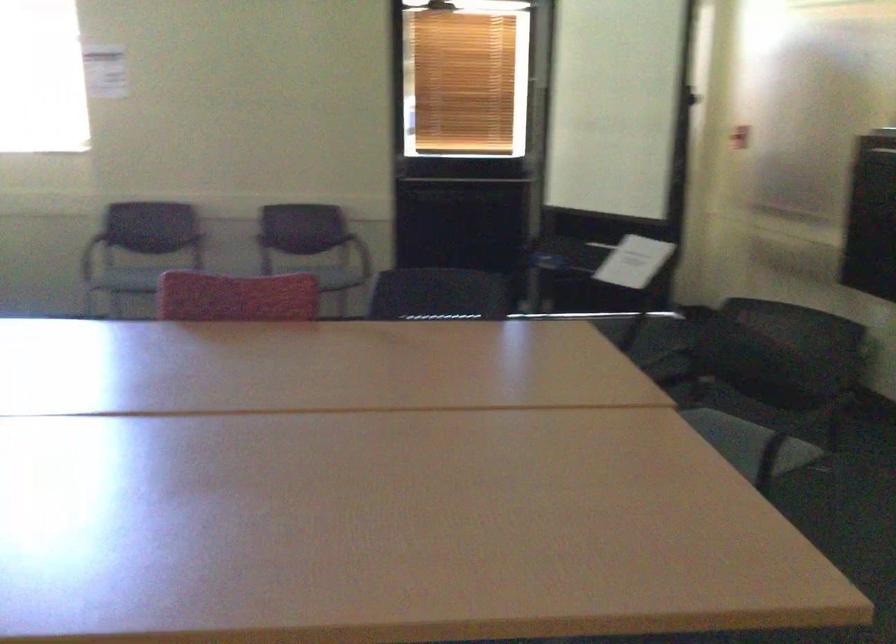
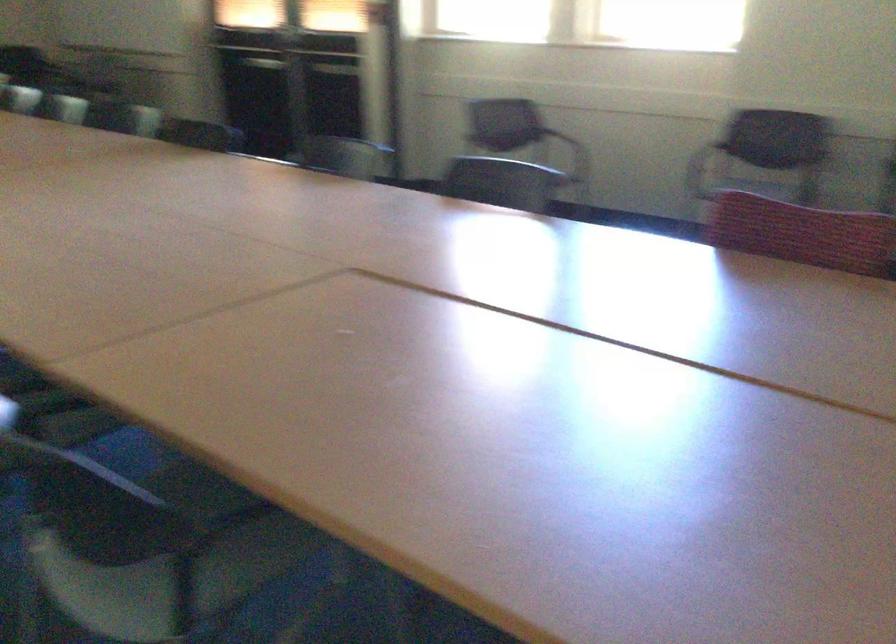
Question: Based on the continuous images, in which direction is the camera rotating? Reply with the corresponding letter.

Choices:
 (A) Left
 (B) Right
 (C) Up
 (D) Down

Answer: (A)